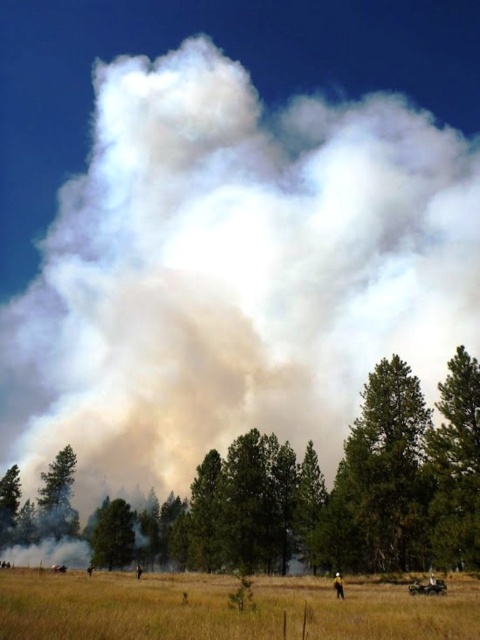
You are a firefighter assessing the wildfire scene. You see the green leafy tree at center and the green textured tree at right. Which tree has a larger width?

The green leafy tree at center might be wider than green textured tree at right.